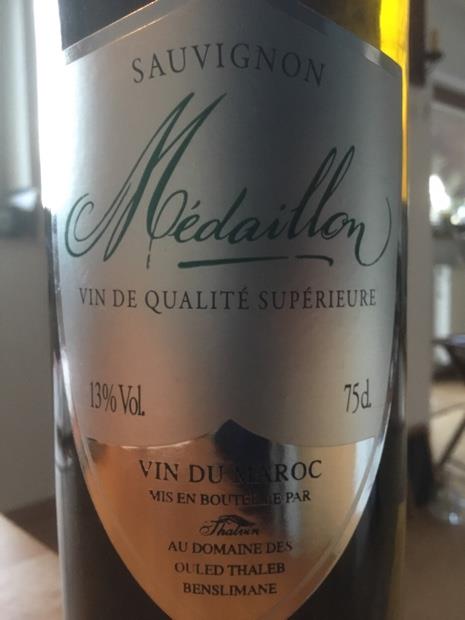
The height and width of the screenshot is (620, 465). In order to click on window in this screenshot , I will do `click(15, 107)`.